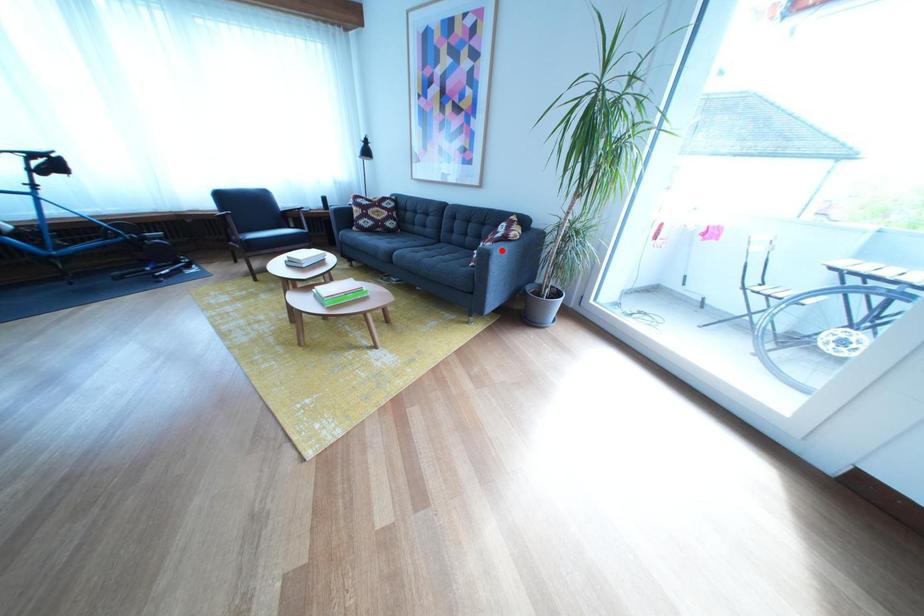
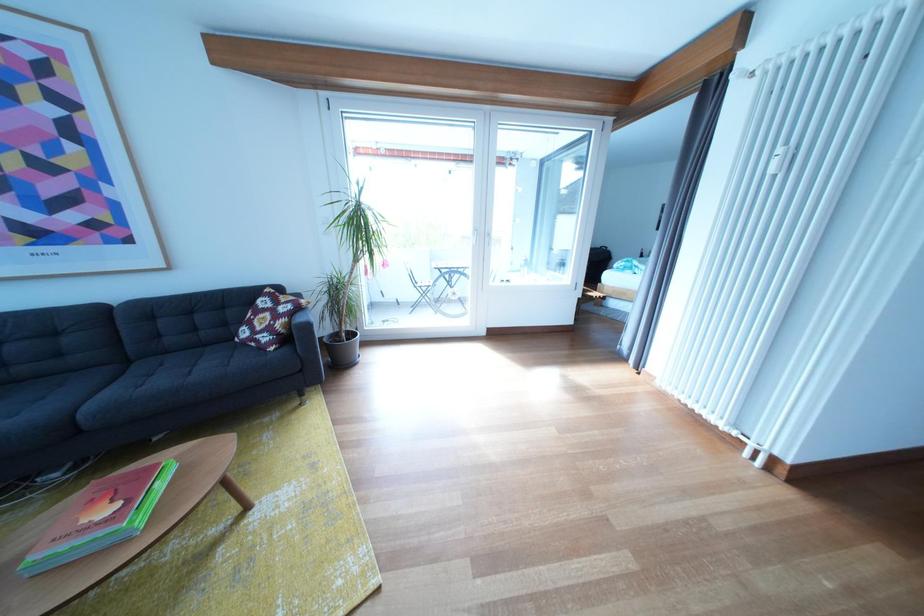
Question: I am providing you with two images of the same scene from different viewpoints. Given a red point in image1, look at the same physical point in image2. Is it:

Choices:
 (A) Closer to the viewpoint
 (B) Farther from the viewpoint

Answer: (A)